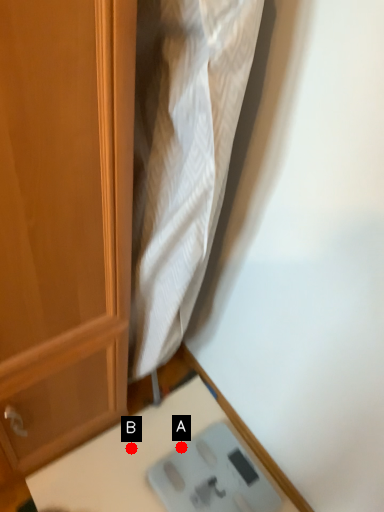
Question: Two points are circled on the image, labeled by A and B beside each circle. Which point appears farthest from the camera in this image?

Choices:
 (A) A is further
 (B) B is further

Answer: (A)